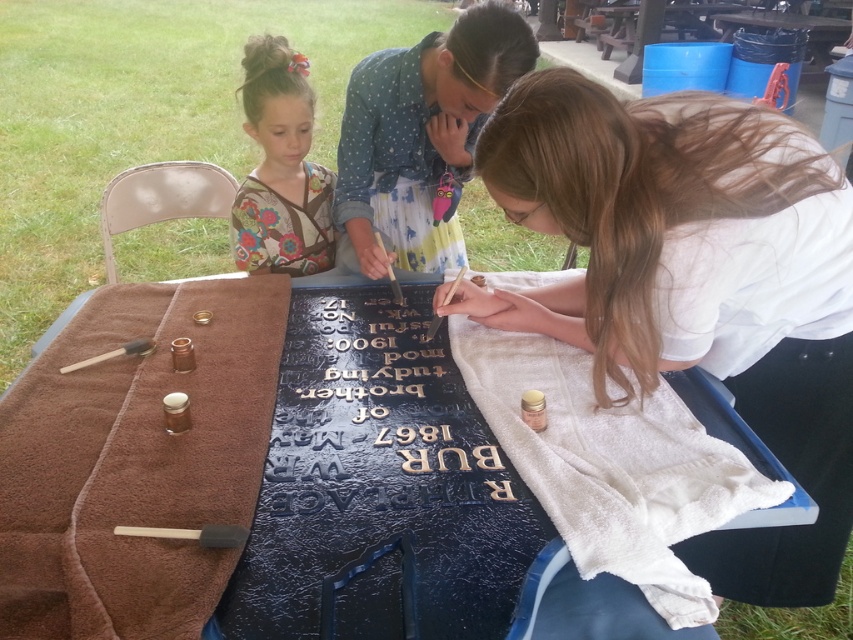
Question: Considering the relative positions of matte white shirt at center and gold embossed letters at center in the image provided, where is matte white shirt at center located with respect to gold embossed letters at center?

Choices:
 (A) right
 (B) left

Answer: (A)

Question: Does gold embossed letters at center appear under floral fabric shirt at upper left?

Choices:
 (A) no
 (B) yes

Answer: (B)

Question: Which is farther from the gold embossed letters at center?

Choices:
 (A) floral fabric shirt at upper left
 (B) matte white shirt at center
 (C) blue textured tablecloth at center

Answer: (A)

Question: Is blue textured tablecloth at center thinner than gold embossed letters at center?

Choices:
 (A) no
 (B) yes

Answer: (A)

Question: Among these points, which one is farthest from the camera?

Choices:
 (A) (259, 77)
 (B) (354, 516)
 (C) (639, 115)
 (D) (341, 625)

Answer: (A)

Question: Which point is closer to the camera taking this photo?

Choices:
 (A) (514, 589)
 (B) (305, 176)
 (C) (724, 342)

Answer: (A)